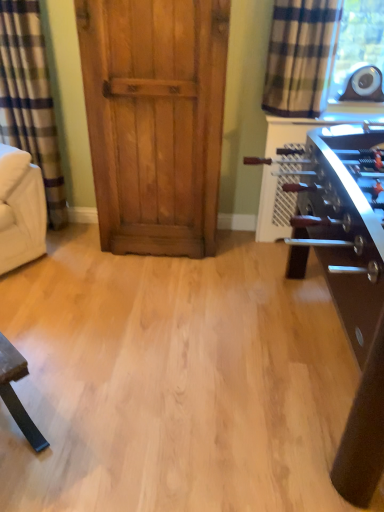
Question: Looking at their shapes, would you say wooden door at center is wider or thinner than shiny brown table at right?

Choices:
 (A) wide
 (B) thin

Answer: (B)

Question: From a real-world perspective, relative to shiny brown table at right, is wooden door at center vertically above or below?

Choices:
 (A) below
 (B) above

Answer: (B)

Question: Based on their relative distances, which object is nearer to the wooden door at center?

Choices:
 (A) white fabric armchair at left
 (B) plaid fabric curtain at upper right, positioned as the first curtain in right-to-left order
 (C) plaid fabric curtain at left, which is the 2th curtain in right-to-left order
 (D) shiny brown table at right

Answer: (C)

Question: Based on their relative distances, which object is farther from the white fabric armchair at left?

Choices:
 (A) wooden door at center
 (B) plaid fabric curtain at left, which appears as the first curtain when viewed from the left
 (C) shiny brown table at right
 (D) plaid fabric curtain at upper right, positioned as the first curtain in right-to-left order

Answer: (C)